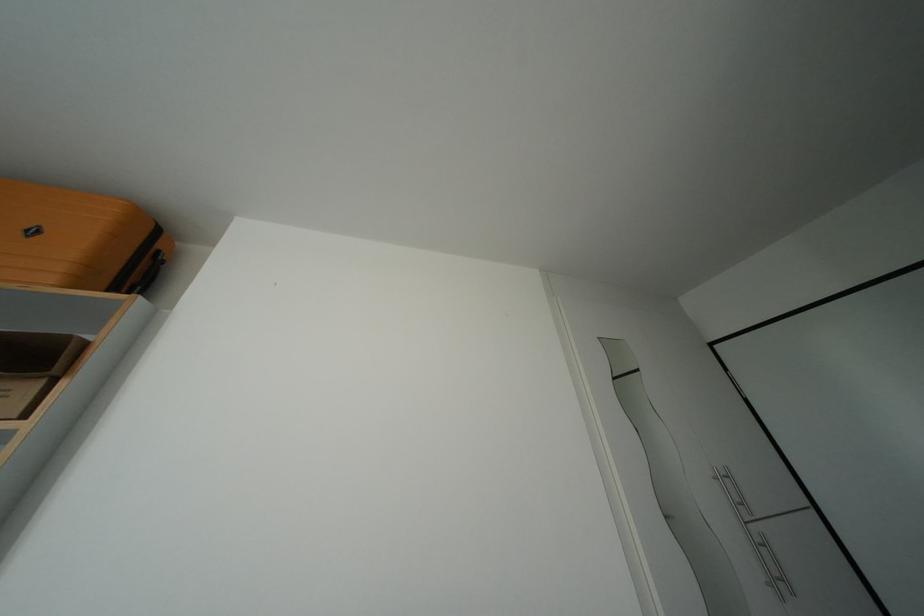
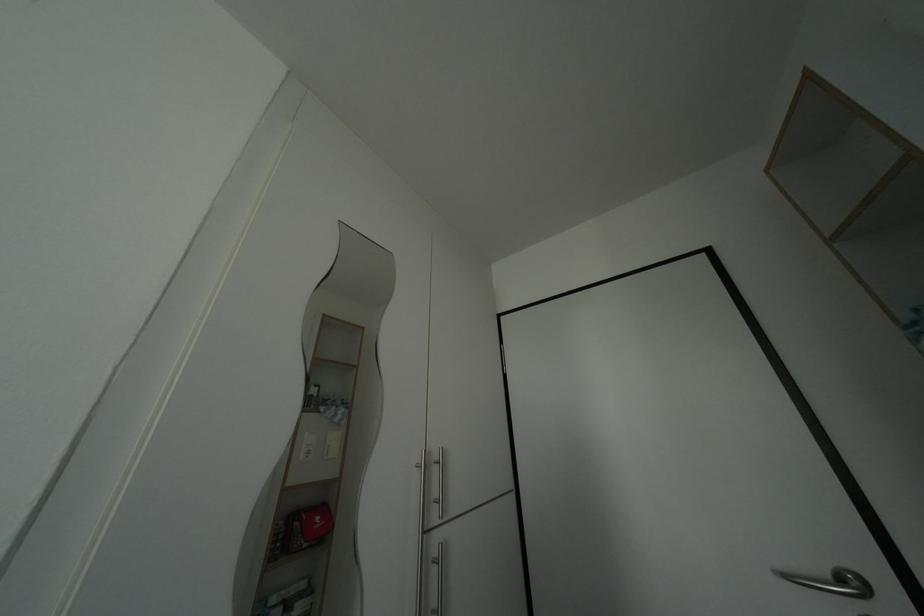
The point at (772, 554) is marked in the first image. Where is the corresponding point in the second image?

(442, 576)